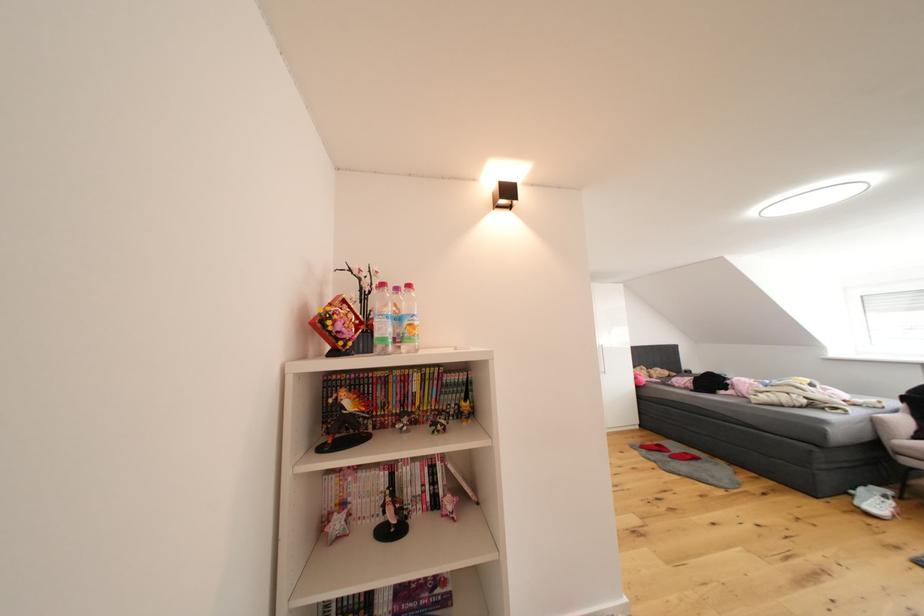
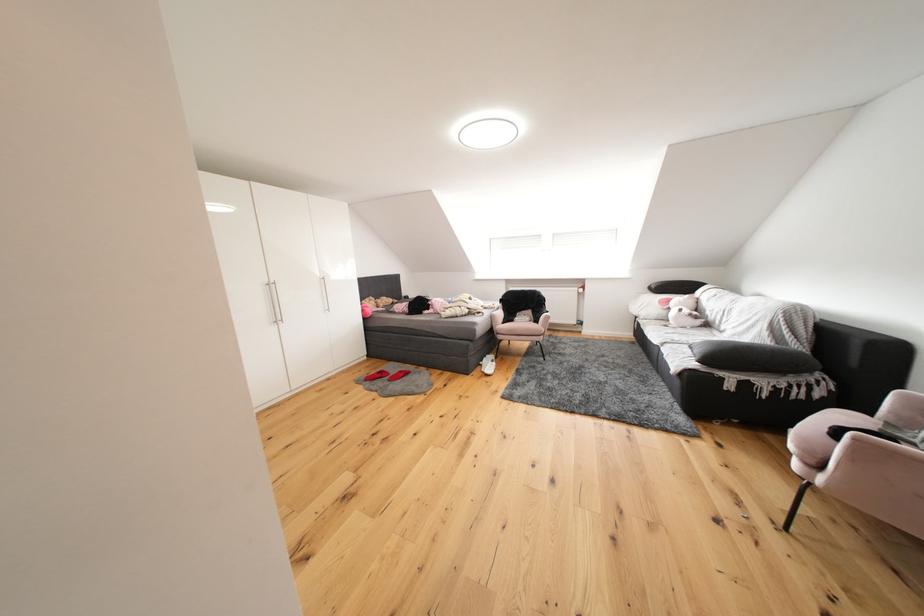
Where in the second image is the point corresponding to point 861,499 from the first image?

(490, 369)